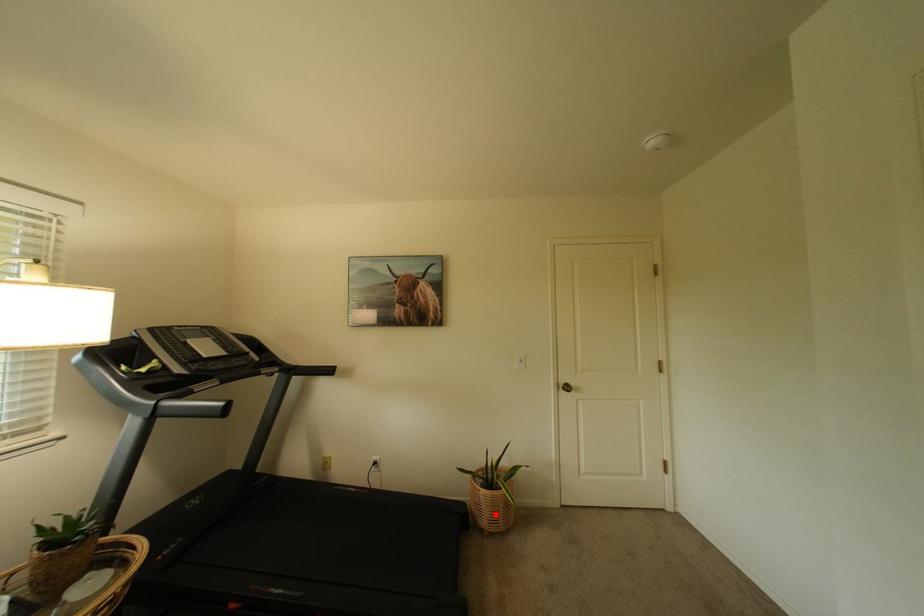
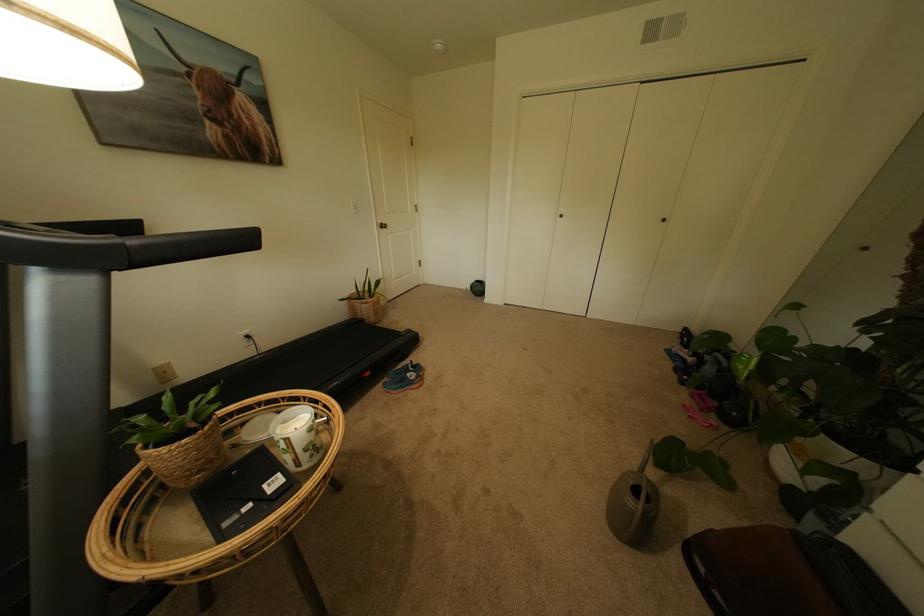
Question: I am providing you with two images of the same scene from different viewpoints. A red point is marked on the first image. Can you still see the location of the red point in image 2?

Choices:
 (A) Yes
 (B) No

Answer: (A)